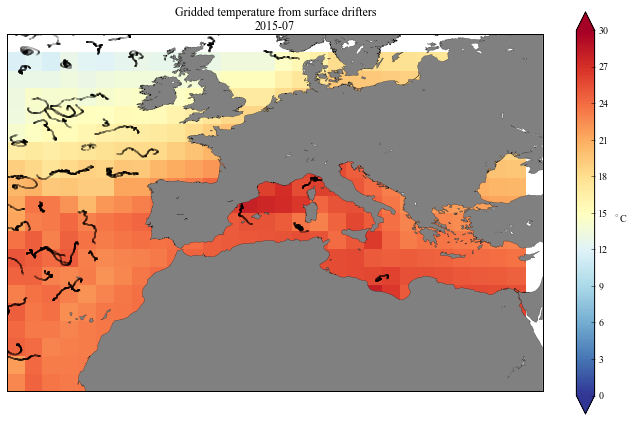
Where is `thermostat`? Image resolution: width=635 pixels, height=421 pixels. thermostat is located at coordinates (584, 65).